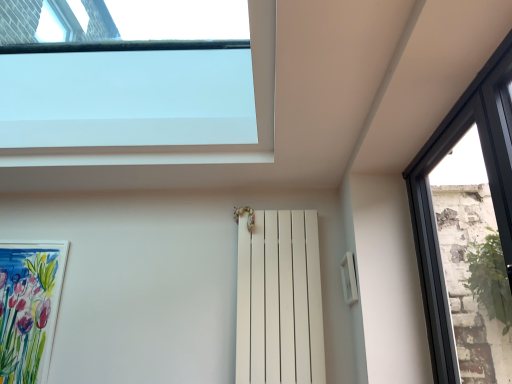
Question: From the image's perspective, relative to black glass window at right, marked as the 2th window in a left-to-right arrangement, is transparent glass window at upper center, which is counted as the 1th window, starting from the left, above or below?

Choices:
 (A) above
 (B) below

Answer: (A)

Question: Is point (265, 102) positioned closer to the camera than point (473, 248)?

Choices:
 (A) closer
 (B) farther

Answer: (A)

Question: Which of these objects is positioned closest to the watercolor paper picture frame at lower left?

Choices:
 (A) transparent glass window at upper center, the second window in the right-to-left sequence
 (B) white matte radiator at center
 (C) black glass window at right, which is counted as the 1th window, starting from the right

Answer: (A)

Question: Considering the real-world distances, which object is closest to the white matte radiator at center?

Choices:
 (A) watercolor paper picture frame at lower left
 (B) black glass window at right, marked as the 2th window in a left-to-right arrangement
 (C) transparent glass window at upper center, the second window in the right-to-left sequence

Answer: (C)